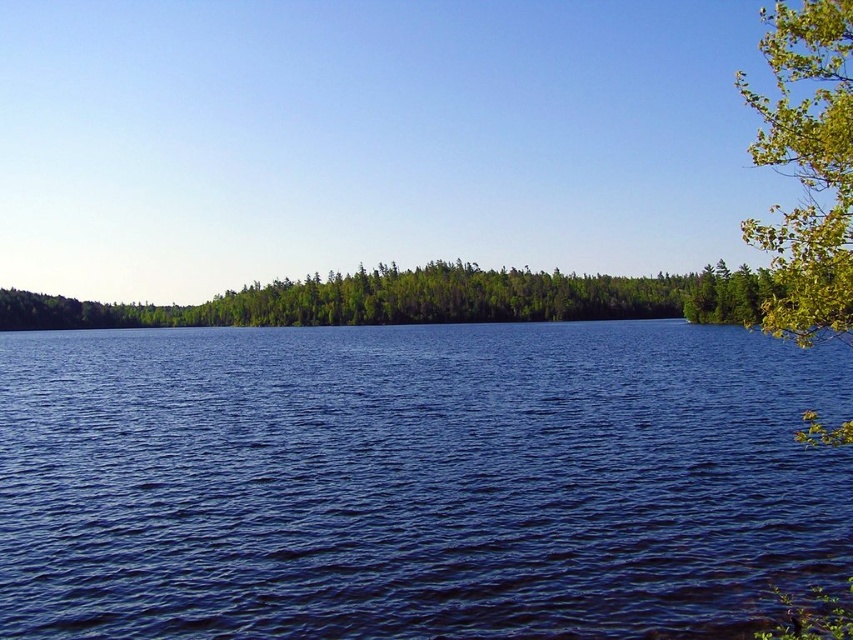
You are standing on the lakeshore and want to determine which object is taller between the green matte forest at center and the green leafy tree at right. Based on their positions in the scene, which one is taller?

The green leafy tree at right is taller than the green matte forest at center.

You are an environmental scientist assessing the health of this ecosystem. Given the presence of blue liquid water at center and green matte forest at center, which one occupies a larger area in the scene?

The green matte forest at center occupies a larger area than the blue liquid water at center in the scene.

You are standing at the edge of the lake in the image. Looking out, you notice a specific point marked at coordinates (422, 300). What does this point represent in the scene?

The point at (422, 300) corresponds to the green matte forest at center, indicating that location is part of the forested area in the midground.